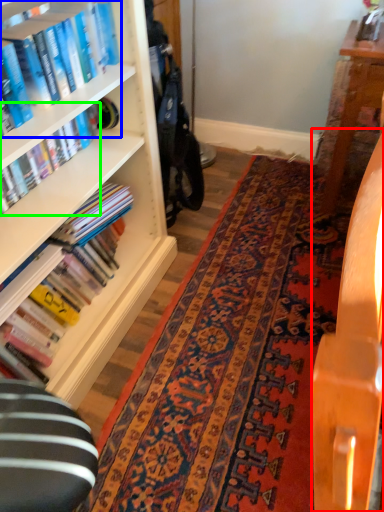
Question: Which is nearer to the table (highlighted by a red box)? book (highlighted by a blue box) or book (highlighted by a green box).

Choices:
 (A) book
 (B) book

Answer: (A)